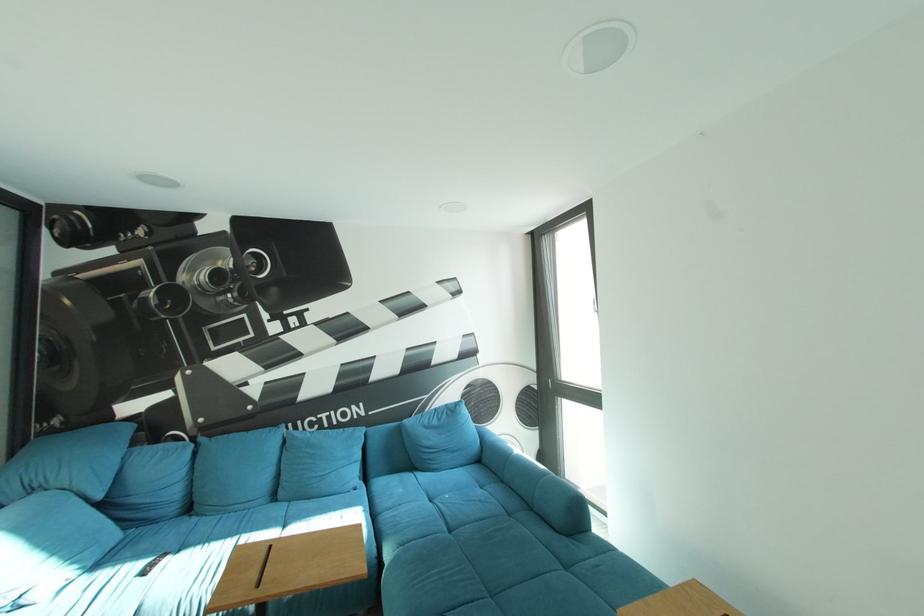
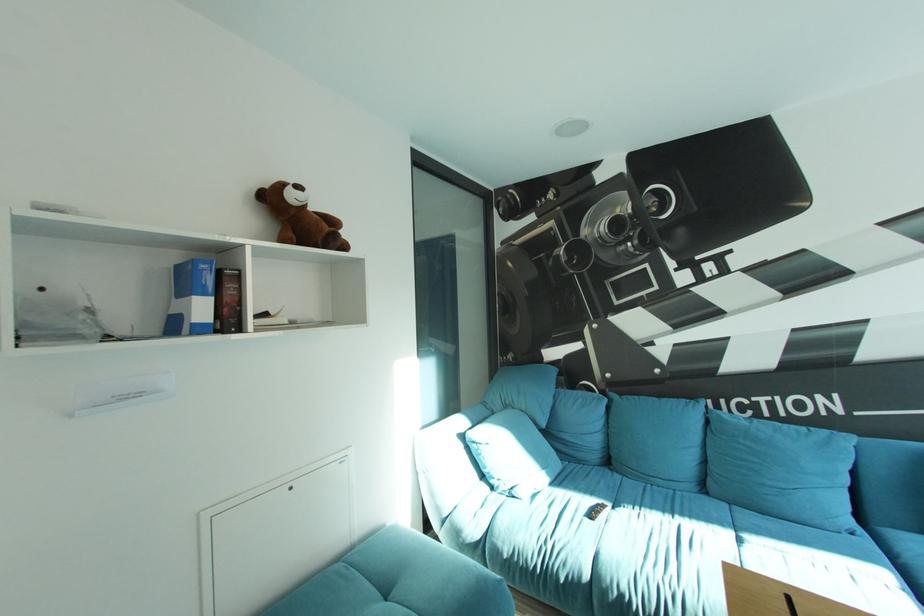
Question: The camera is either moving clockwise (left) or counter-clockwise (right) around the object. The first image is from the beginning of the video and the second image is from the end. Is the camera moving left or right when shooting the video?

Choices:
 (A) Left
 (B) Right

Answer: (B)